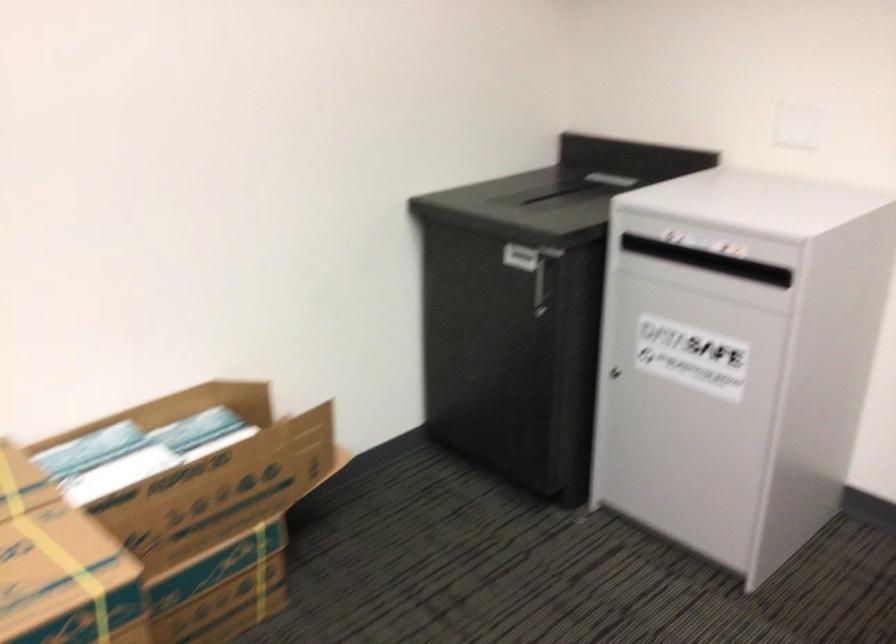
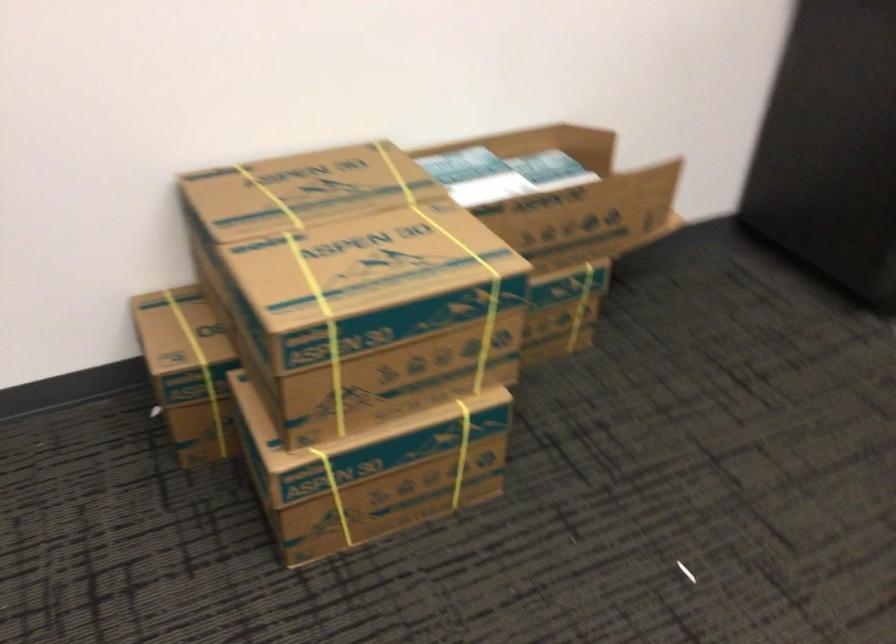
Question: The images are taken continuously from a first-person perspective. In which direction are you moving?

Choices:
 (A) Left
 (B) Right
 (C) Forward
 (D) Backward

Answer: (A)